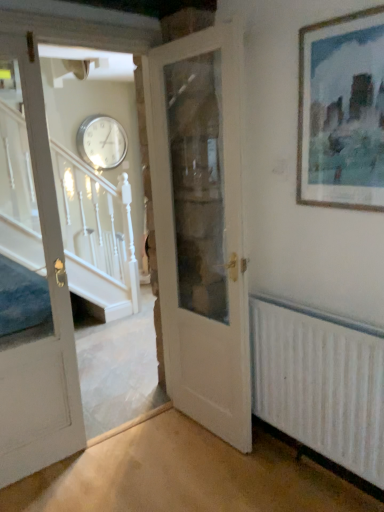
Question: From a real-world perspective, is silver metallic clock at upper center located higher than white wooden door at center, the 2th door from the left?

Choices:
 (A) yes
 (B) no

Answer: (A)

Question: Is silver metallic clock at upper center not near white wooden door at center, the 2th door from the left?

Choices:
 (A) yes
 (B) no

Answer: (A)

Question: Are silver metallic clock at upper center and white wooden door at center, placed as the 1th door when sorted from right to left, making contact?

Choices:
 (A) no
 (B) yes

Answer: (A)

Question: Does silver metallic clock at upper center have a lesser width compared to white wooden door at center, placed as the 1th door when sorted from right to left?

Choices:
 (A) yes
 (B) no

Answer: (A)

Question: Can you confirm if silver metallic clock at upper center is taller than white wooden door at center, the 2th door from the left?

Choices:
 (A) no
 (B) yes

Answer: (A)

Question: From a real-world perspective, is silver metallic clock at upper center below white wooden door at center, placed as the 1th door when sorted from right to left?

Choices:
 (A) yes
 (B) no

Answer: (B)

Question: From a real-world perspective, does white painted wood door at left, arranged as the 2th door when viewed from the right, sit lower than wooden picture frame at upper right?

Choices:
 (A) yes
 (B) no

Answer: (A)

Question: Is white painted wood door at left, the first door viewed from the left, further to the viewer compared to wooden picture frame at upper right?

Choices:
 (A) no
 (B) yes

Answer: (B)

Question: Could you tell me if white painted wood door at left, arranged as the 2th door when viewed from the right, is turned towards wooden picture frame at upper right?

Choices:
 (A) no
 (B) yes

Answer: (A)

Question: From the image's perspective, is white painted wood door at left, arranged as the 2th door when viewed from the right, over wooden picture frame at upper right?

Choices:
 (A) no
 (B) yes

Answer: (A)

Question: Considering the relative sizes of white painted wood door at left, the first door viewed from the left, and wooden picture frame at upper right in the image provided, is white painted wood door at left, the first door viewed from the left, taller than wooden picture frame at upper right?

Choices:
 (A) yes
 (B) no

Answer: (A)

Question: Is white painted wood door at left, arranged as the 2th door when viewed from the right, not within wooden picture frame at upper right?

Choices:
 (A) no
 (B) yes

Answer: (B)

Question: Is white painted wood door at left, arranged as the 2th door when viewed from the right, not within white wooden door at center, placed as the 1th door when sorted from right to left?

Choices:
 (A) no
 (B) yes

Answer: (B)